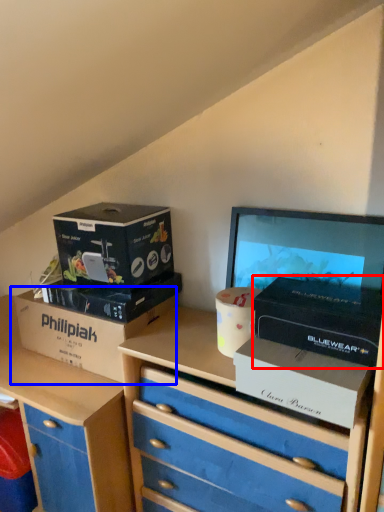
Question: Which point is closer to the camera, box (highlighted by a red box) or box (highlighted by a blue box)?

Choices:
 (A) box
 (B) box

Answer: (A)